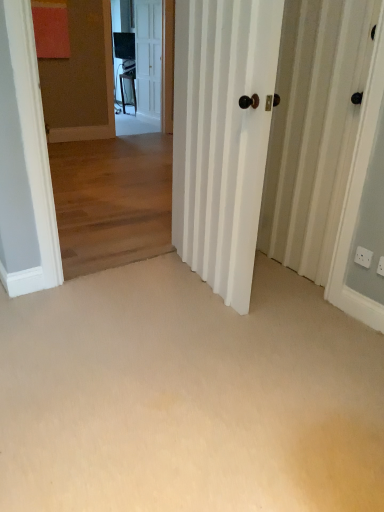
Where is `vacant area that is situated to the right of wooden floor at center, the 1th corridor when ordered from top to bottom`? This screenshot has width=384, height=512. vacant area that is situated to the right of wooden floor at center, the 1th corridor when ordered from top to bottom is located at coordinates (177, 274).